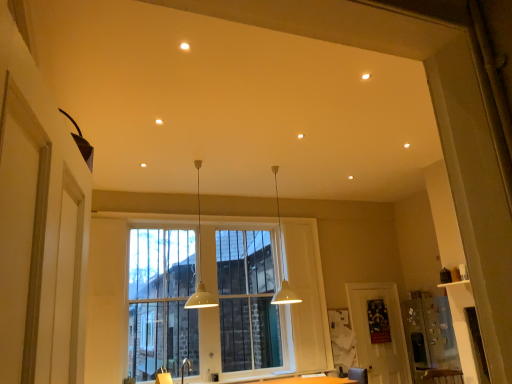
In order to click on vacant area on top of white matte pendant light at center, the first lamp positioned from the left (from a real-world perspective) in this screenshot , I will do `click(195, 163)`.